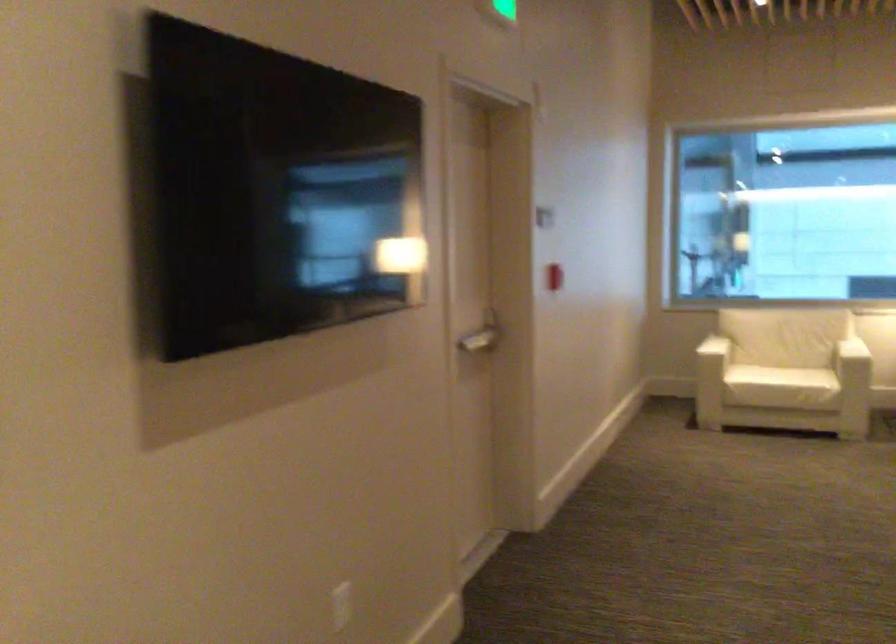
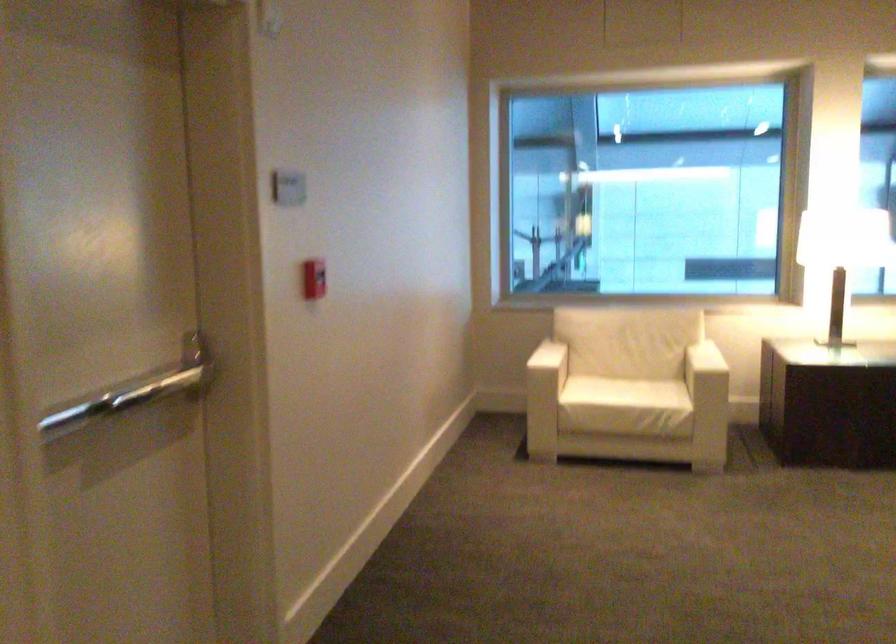
What movement of the cameraman would produce the second image?

The movement direction of the cameraman is right, forward.